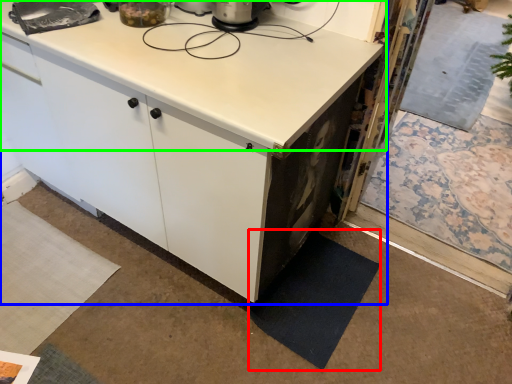
Question: Which object is the closest to the mat (highlighted by a red box)? Choose among these: cabinetry (highlighted by a blue box) or countertop (highlighted by a green box).

Choices:
 (A) cabinetry
 (B) countertop

Answer: (A)